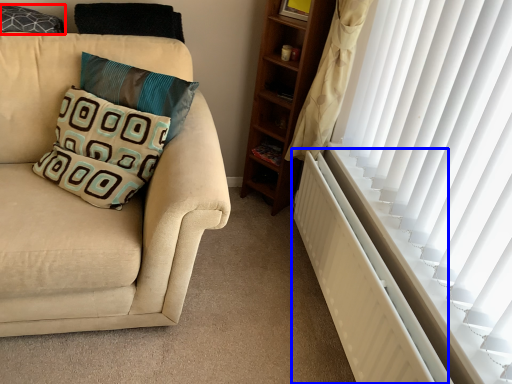
Question: Which point is further to the camera, pillow (highlighted by a red box) or radiator (highlighted by a blue box)?

Choices:
 (A) pillow
 (B) radiator

Answer: (A)